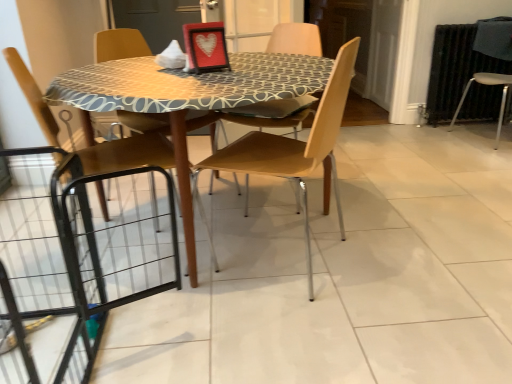
The height and width of the screenshot is (384, 512). What are the coordinates of `vacant area to the right of matte black picture frame at center` in the screenshot? It's located at tap(250, 61).